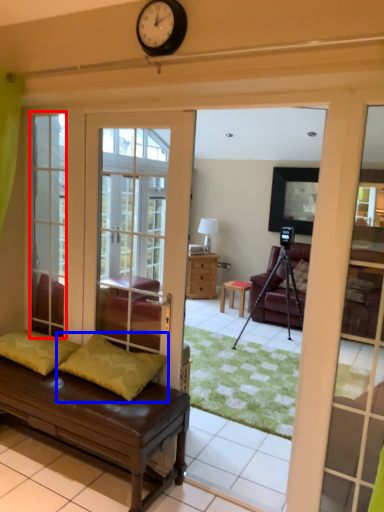
Question: Which of the following is the closest to the observer, glass door (highlighted by a red box) or pillow (highlighted by a blue box)?

Choices:
 (A) glass door
 (B) pillow

Answer: (B)